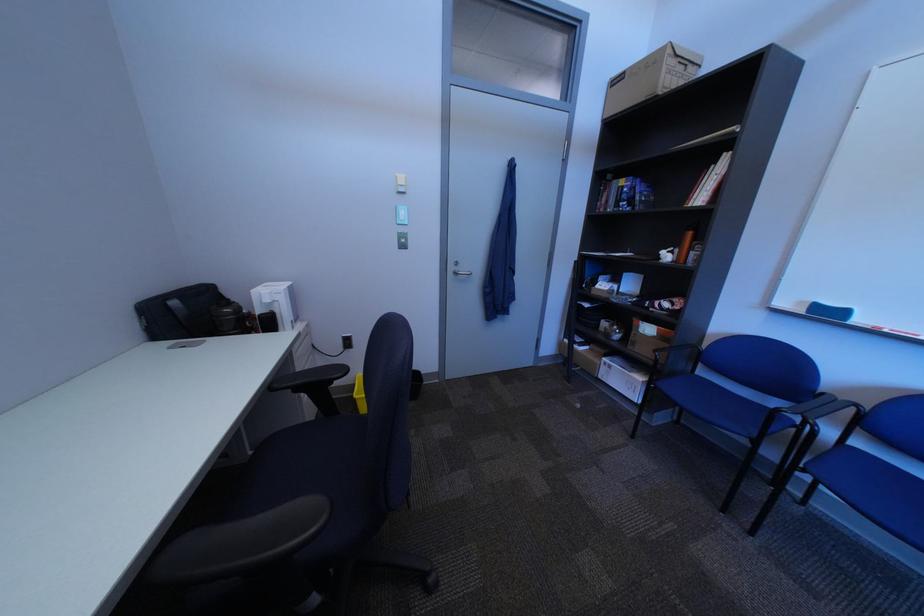
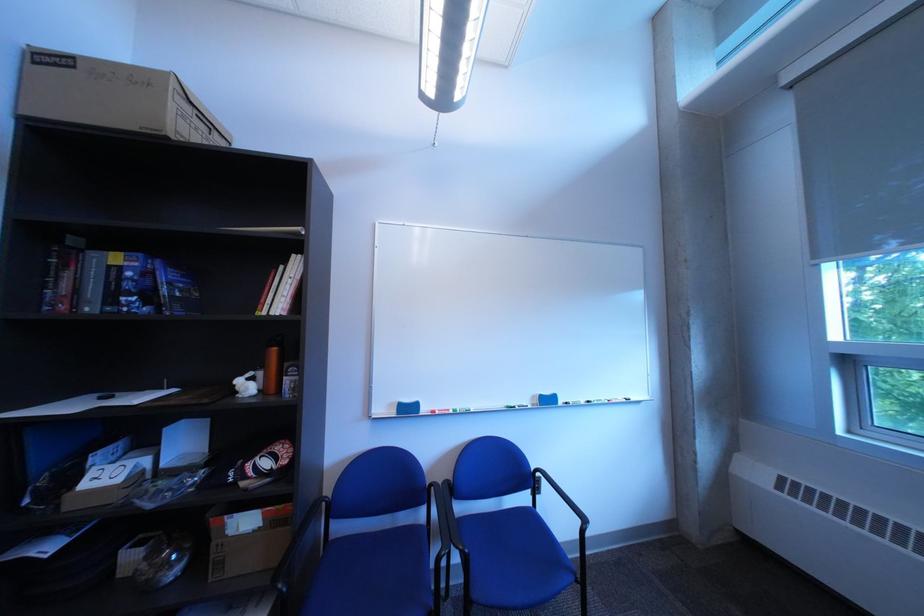
Locate, in the second image, the point that corresponds to the point at 675,257 in the first image.

(249, 387)